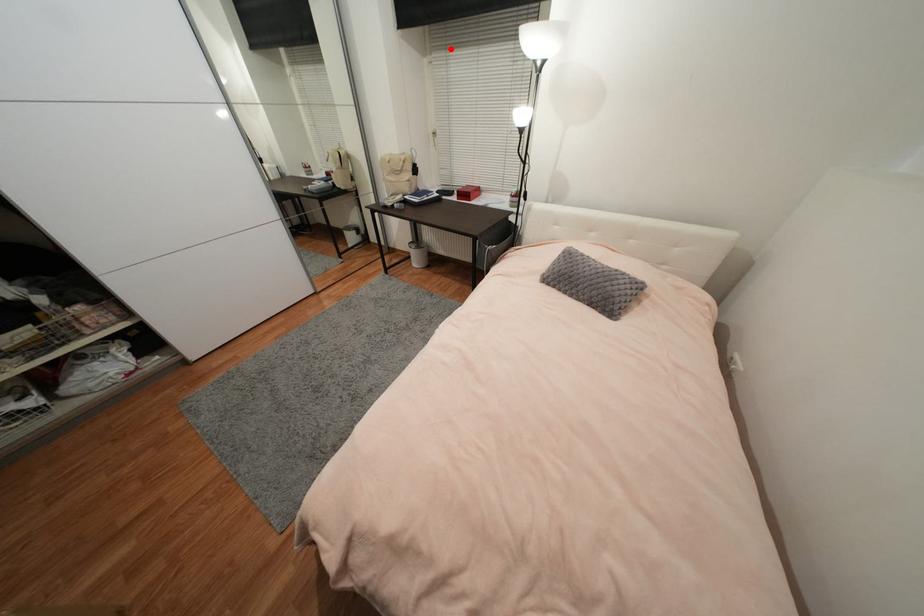
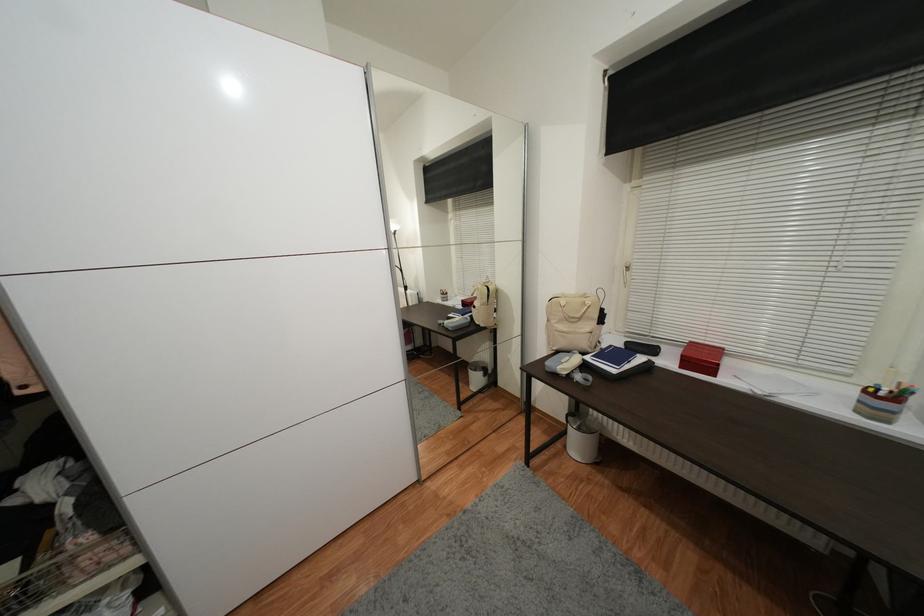
Where in the second image is the point corresponding to the highlighted location from the first image?

(678, 167)